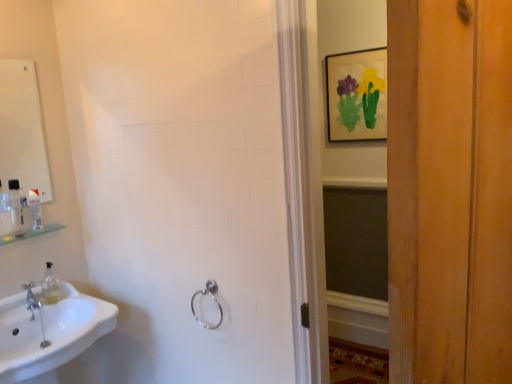
This screenshot has width=512, height=384. In order to click on white glossy sink at lower left in this screenshot , I will do `click(50, 334)`.

How much space does clear plastic bottle at upper left, arranged as the 2th toiletry when viewed from the back, occupy horizontally?

clear plastic bottle at upper left, arranged as the 2th toiletry when viewed from the back, is 2.26 inches in width.

Measure the distance between point (11, 194) and camera.

Point (11, 194) is 5.54 feet away from camera.

Image resolution: width=512 pixels, height=384 pixels. What do you see at coordinates (214, 300) in the screenshot?
I see `silver metallic towel ring at lower center` at bounding box center [214, 300].

What are the coordinates of `matte paper picture frame at upper center` in the screenshot? It's located at (356, 95).

Image resolution: width=512 pixels, height=384 pixels. What are the coordinates of `white glossy sink at lower left` in the screenshot? It's located at (50, 334).

Is matte paper picture frame at upper center aimed at silver metallic towel ring at lower center?

Yes.

Is matte paper picture frame at upper center shorter than silver metallic towel ring at lower center?

Incorrect, the height of matte paper picture frame at upper center does not fall short of that of silver metallic towel ring at lower center.

Between matte paper picture frame at upper center and silver metallic towel ring at lower center, which one has smaller width?

matte paper picture frame at upper center is thinner.

From the matte paper picture frame at upper center, count the 2nd toiletry to the left and point to it. Please provide its 2D coordinates.

[(16, 207)]

Is point (16, 185) closer or farther from the camera than point (360, 63)?

Point (16, 185) is positioned closer to the camera compared to point (360, 63).

Can you see clear plastic bottle at upper left, arranged as the 2th toiletry when viewed from the back, touching matte paper picture frame at upper center?

No, clear plastic bottle at upper left, arranged as the 2th toiletry when viewed from the back, is not making contact with matte paper picture frame at upper center.

Can you confirm if green glass shelf at left is positioned to the left of white glossy mirror at upper left?

No, green glass shelf at left is not to the left of white glossy mirror at upper left.

Is green glass shelf at left aimed at white glossy mirror at upper left?

No, green glass shelf at left does not turn towards white glossy mirror at upper left.

Is green glass shelf at left touching white glossy mirror at upper left?

No, green glass shelf at left is not touching white glossy mirror at upper left.

Considering the relative sizes of silver metallic towel ring at lower center and white glossy sink at lower left in the image provided, is silver metallic towel ring at lower center taller than white glossy sink at lower left?

In fact, silver metallic towel ring at lower center may be shorter than white glossy sink at lower left.

Looking at their sizes, would you say silver metallic towel ring at lower center is wider or thinner than white glossy sink at lower left?

Clearly, silver metallic towel ring at lower center has less width compared to white glossy sink at lower left.

This screenshot has width=512, height=384. In order to click on sink below the silver metallic towel ring at lower center (from the image's perspective) in this screenshot , I will do `click(50, 334)`.

From the image's perspective, is silver metallic towel ring at lower center located beneath white glossy sink at lower left?

No.

Could you tell me if white glossy mirror at upper left is facing clear plastic bottle at upper left, placed as the first toiletry when sorted from front to back?

Yes, white glossy mirror at upper left faces towards clear plastic bottle at upper left, placed as the first toiletry when sorted from front to back.

From the image's perspective, between white glossy mirror at upper left and clear plastic bottle at upper left, placed as the first toiletry when sorted from front to back, who is located below?

clear plastic bottle at upper left, placed as the first toiletry when sorted from front to back.

Does white glossy mirror at upper left appear on the left side of clear plastic bottle at upper left, placed as the first toiletry when sorted from front to back?

Correct, you'll find white glossy mirror at upper left to the left of clear plastic bottle at upper left, placed as the first toiletry when sorted from front to back.

Between white glossy mirror at upper left and clear plastic bottle at upper left, placed as the first toiletry when sorted from front to back, which one has less height?

Standing shorter between the two is clear plastic bottle at upper left, placed as the first toiletry when sorted from front to back.

Is the position of silver metallic towel ring at lower center less distant than that of white glossy mirror at upper left?

Yes.

From the image's perspective, which one is positioned lower, silver metallic towel ring at lower center or white glossy mirror at upper left?

silver metallic towel ring at lower center is shown below in the image.

Based on the photo, is silver metallic towel ring at lower center turned away from white glossy mirror at upper left?

No.

Considering the points (212, 328) and (31, 97), which point is in front, point (212, 328) or point (31, 97)?

The point (212, 328) is closer to the camera.

Is the position of white glossy mirror at upper left more distant than that of green glass shelf at left?

No, white glossy mirror at upper left is closer to the camera.

Which of these two, white glossy mirror at upper left or green glass shelf at left, is smaller?

green glass shelf at left.

Considering the points (28, 182) and (62, 227), which point is in front, point (28, 182) or point (62, 227)?

The point (62, 227) is closer to the camera.

Is white glossy mirror at upper left directly adjacent to green glass shelf at left?

No, white glossy mirror at upper left is not beside green glass shelf at left.

Identify the location of towel rack in front of the matte paper picture frame at upper center. The width and height of the screenshot is (512, 384). (214, 300).

In order to click on picture frame located above the clear plastic bottle at upper left, placed as the first toiletry when sorted from front to back (from the image's perspective) in this screenshot , I will do (356, 95).

Based on their spatial positions, is white glossy sink at lower left or silver metallic towel ring at lower center closer to matte paper picture frame at upper center?

silver metallic towel ring at lower center.

Estimate the real-world distances between objects in this image. Which object is further from green glass shelf at left, white glossy mirror at upper left or white glossy sink at lower left?

white glossy mirror at upper left is positioned further to the anchor green glass shelf at left.

When comparing their distances from green glass shelf at left, does matte paper picture frame at upper center or silver metallic towel ring at lower center seem closer?

Among the two, silver metallic towel ring at lower center is located nearer to green glass shelf at left.

Estimate the real-world distances between objects in this image. Which object is closer to green glass shelf at left, clear plastic bottle at upper left, placed as the first toiletry when sorted from front to back, or white glossy sink at lower left?

Based on the image, clear plastic bottle at upper left, placed as the first toiletry when sorted from front to back, appears to be nearer to green glass shelf at left.

Which object lies further to the anchor point clear plastic bottle at left, which appears as the 1th toiletry when viewed from the back, clear plastic bottle at upper left, arranged as the 2th toiletry when viewed from the back, or matte paper picture frame at upper center?

The object further to clear plastic bottle at left, which appears as the 1th toiletry when viewed from the back, is matte paper picture frame at upper center.

From the image, which object appears to be farther from clear plastic bottle at upper left, placed as the first toiletry when sorted from front to back, white glossy sink at lower left or silver metallic towel ring at lower center?

silver metallic towel ring at lower center is positioned further to the anchor clear plastic bottle at upper left, placed as the first toiletry when sorted from front to back.

When comparing their distances from clear plastic bottle at upper left, placed as the first toiletry when sorted from front to back, does clear plastic bottle at left, which appears as the 1th toiletry when viewed from the back, or matte paper picture frame at upper center seem closer?

The object closer to clear plastic bottle at upper left, placed as the first toiletry when sorted from front to back, is clear plastic bottle at left, which appears as the 1th toiletry when viewed from the back.

Estimate the real-world distances between objects in this image. Which object is closer to clear plastic bottle at left, which appears as the 1th toiletry when viewed from the back, silver metallic towel ring at lower center or matte paper picture frame at upper center?

Among the two, silver metallic towel ring at lower center is located nearer to clear plastic bottle at left, which appears as the 1th toiletry when viewed from the back.

You are a GUI agent. You are given a task and a screenshot of the screen. Output one action in this format:
    pyautogui.click(x=<x>, y=<y>)
    Task: Click on the toiletry between clear plastic bottle at upper left, arranged as the 2th toiletry when viewed from the back, and green glass shelf at left vertically
    Image resolution: width=512 pixels, height=384 pixels.
    Given the screenshot: What is the action you would take?
    pyautogui.click(x=35, y=209)

Where is `shelf located between clear plastic bottle at left, which appears as the 1th toiletry when viewed from the back, and silver metallic towel ring at lower center in the left-right direction`? The image size is (512, 384). shelf located between clear plastic bottle at left, which appears as the 1th toiletry when viewed from the back, and silver metallic towel ring at lower center in the left-right direction is located at coordinates (30, 233).

This screenshot has width=512, height=384. I want to click on toiletry between white glossy mirror at upper left and clear plastic bottle at left, the second toiletry when ordered from front to back, in the vertical direction, so click(16, 207).

This screenshot has height=384, width=512. Identify the location of shelf between clear plastic bottle at upper left, placed as the first toiletry when sorted from front to back, and silver metallic towel ring at lower center, in the horizontal direction. (30, 233).